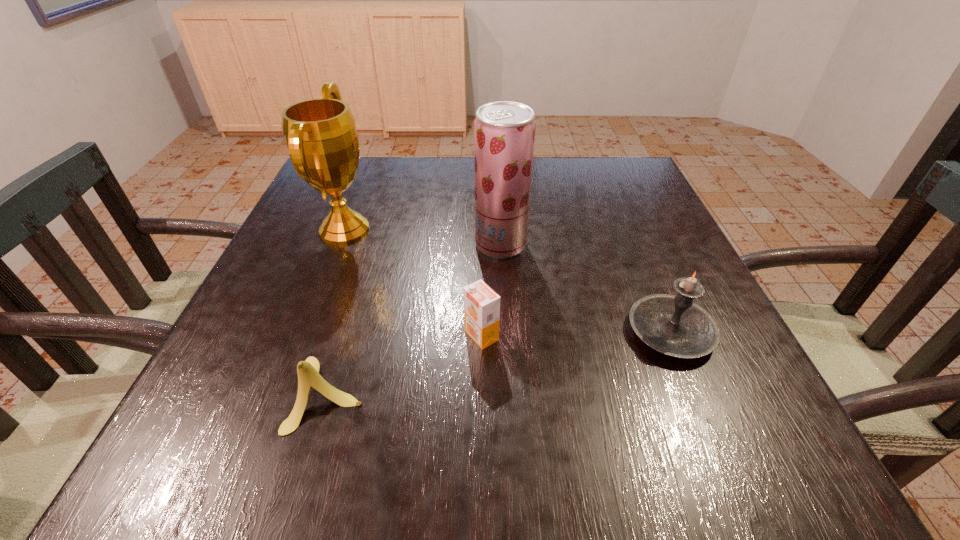
In order to click on vacant space located 0.370m on the right of the banana in this screenshot , I will do `click(601, 393)`.

This screenshot has width=960, height=540. Find the location of `object present at the far edge`. object present at the far edge is located at coordinates (321, 136).

The image size is (960, 540). What are the coordinates of `object that is at the near edge` in the screenshot? It's located at (308, 371).

Where is `award that is at the left edge`? award that is at the left edge is located at coordinates (321, 136).

Find the location of `banana present at the left edge`. banana present at the left edge is located at coordinates (308, 371).

Where is `object that is positioned at the right edge`? object that is positioned at the right edge is located at coordinates (674, 325).

This screenshot has width=960, height=540. In order to click on object that is at the far left corner in this screenshot , I will do `click(321, 136)`.

Where is `object at the near left corner`? Image resolution: width=960 pixels, height=540 pixels. object at the near left corner is located at coordinates (308, 371).

Find the location of a particular element. The image size is (960, 540). vacant area at the far edge of the desktop is located at coordinates (430, 174).

Identify the location of free space at the near edge. The height and width of the screenshot is (540, 960). (455, 433).